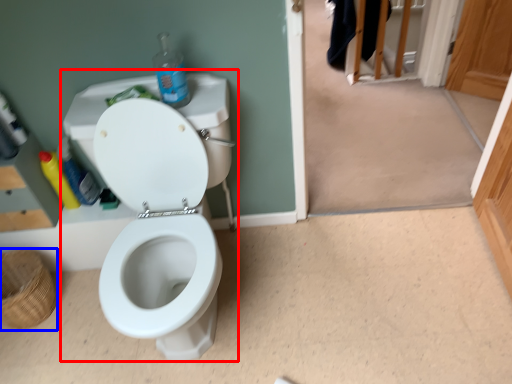
Question: Which object is further to the camera taking this photo, sink (highlighted by a red box) or basket (highlighted by a blue box)?

Choices:
 (A) sink
 (B) basket

Answer: (B)